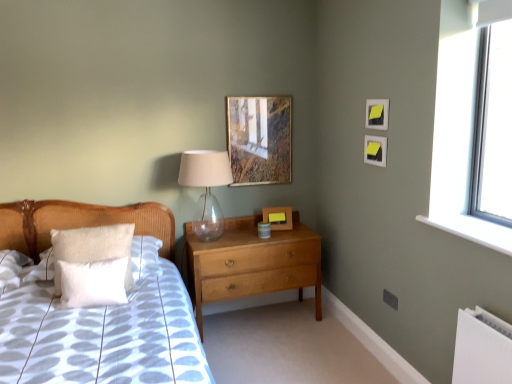
Where is `free space in front of wooden picture frame at center, the first picture frame viewed from the back`? This screenshot has width=512, height=384. free space in front of wooden picture frame at center, the first picture frame viewed from the back is located at coordinates (286, 235).